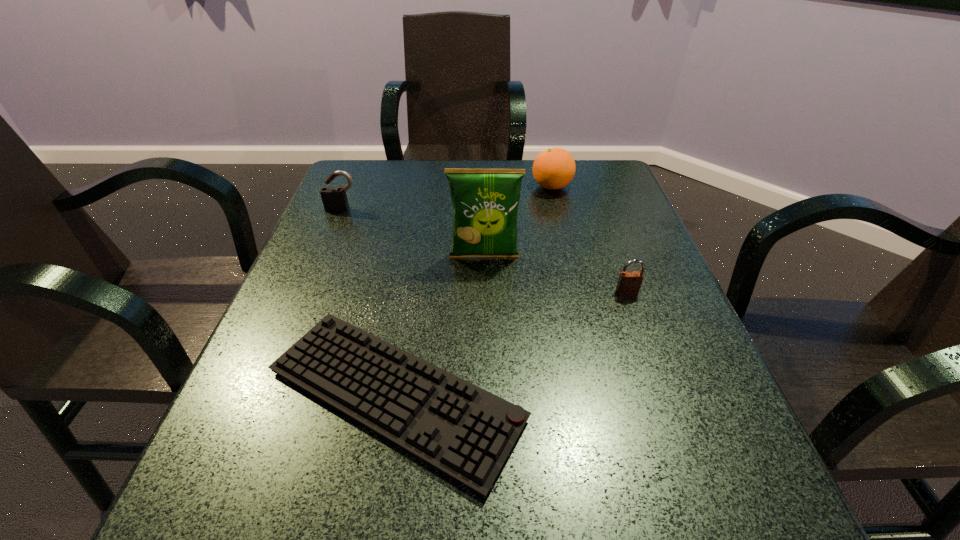
The width and height of the screenshot is (960, 540). I want to click on vacant space located on the front-facing side of the tallest object, so click(485, 295).

Find the location of a particular element. The image size is (960, 540). vacant region located on the right of the farthest object is located at coordinates (610, 187).

Locate an element on the screen. This screenshot has height=540, width=960. free space located with the keyhole on the front of the taller padlock is located at coordinates (289, 336).

Locate an element on the screen. The image size is (960, 540). vacant area situated on the front-facing side of the second shortest object is located at coordinates (651, 361).

The image size is (960, 540). In order to click on free point located 0.070m on the back of the shortest object in this screenshot , I will do `click(412, 293)`.

You are a GUI agent. You are given a task and a screenshot of the screen. Output one action in this format:
    pyautogui.click(x=<x>, y=<y>)
    Task: Click on the object that is at the far edge
    The width and height of the screenshot is (960, 540).
    Given the screenshot: What is the action you would take?
    pyautogui.click(x=554, y=168)

Locate an element on the screen. object located at the near edge is located at coordinates (462, 430).

Find the location of `padlock that is at the left edge`. padlock that is at the left edge is located at coordinates (334, 199).

I want to click on computer keyboard that is at the left edge, so click(x=462, y=430).

Where is `orange that is at the right edge`? Image resolution: width=960 pixels, height=540 pixels. orange that is at the right edge is located at coordinates (554, 168).